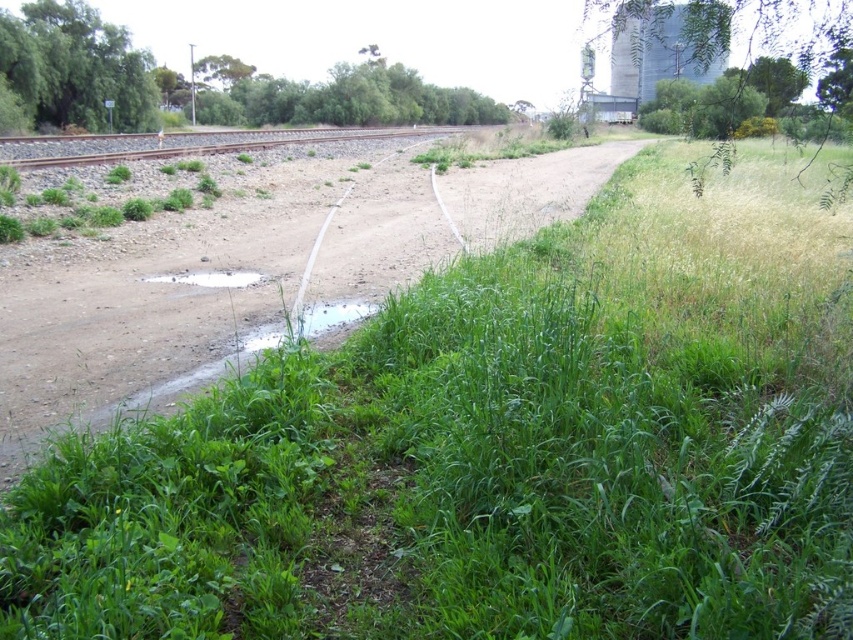
You are a delivery robot with a 36 inch wide package. You need to navigate through the path between the clear water at center and the white matte puddle at center. Can you pass through without touching either?

The clear water at center and white matte puddle at center are 33.51 inches apart from each other. Since your package is 36 inches wide, it is wider than the gap between them, so you cannot pass through without touching either.

You are a farmer checking the drainage system in the field. You notice the clear water at center and the white matte puddle at center. Which one is directly above the other?

The clear water at center is positioned under the white matte puddle at center, so the white matte puddle at center is directly above the clear water at center.